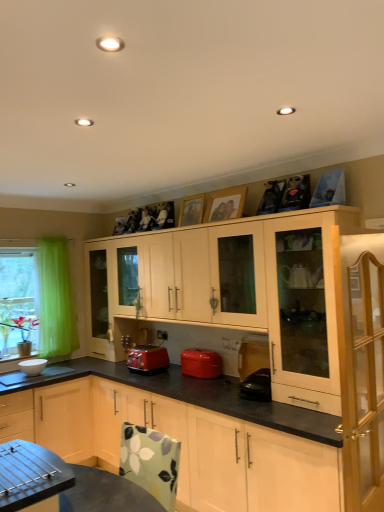
You are a GUI agent. You are given a task and a screenshot of the screen. Output one action in this format:
    pyautogui.click(x=<x>, y=<y>)
    Task: Click on the vacant space underneath white glossy bowl at lower left, the first appliance viewed from the back (from a real-world perspective)
    The height and width of the screenshot is (512, 384).
    Given the screenshot: What is the action you would take?
    pyautogui.click(x=43, y=372)